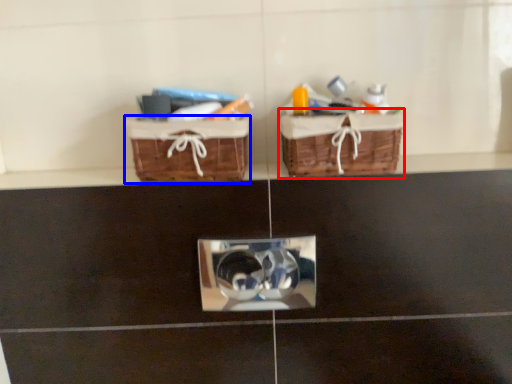
Question: Which object is further to the camera taking this photo, picnic basket (highlighted by a red box) or picnic basket (highlighted by a blue box)?

Choices:
 (A) picnic basket
 (B) picnic basket

Answer: (B)